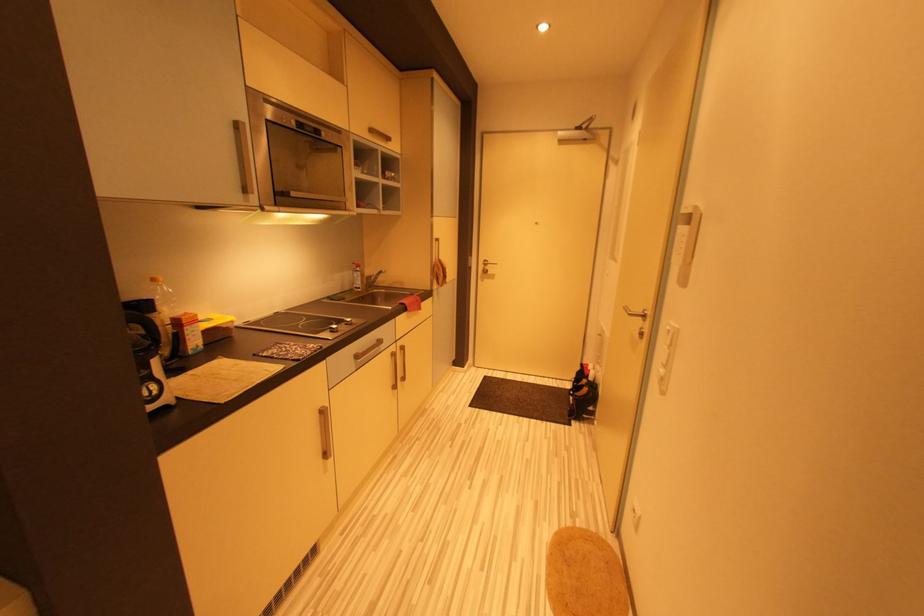
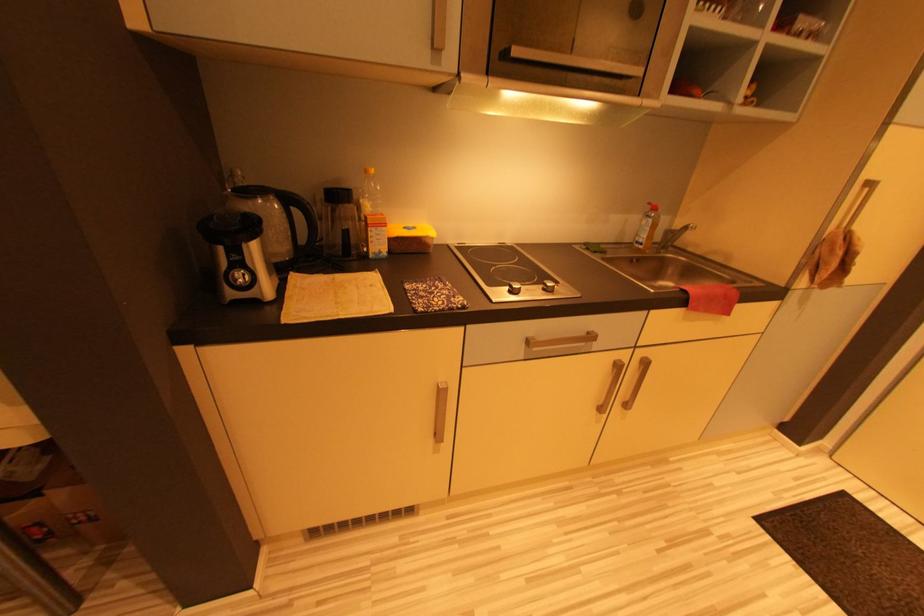
First-person continuous shooting, in which direction is the camera rotating?

The camera rotated toward left-down.